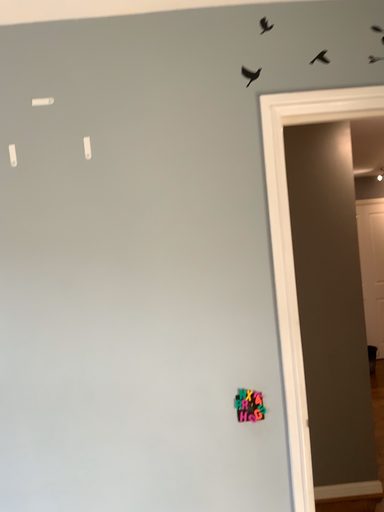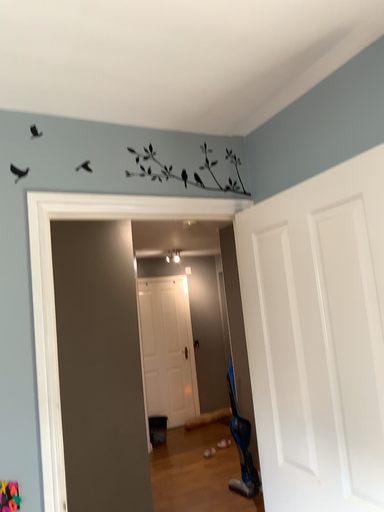
Question: How did the camera likely rotate when shooting the video?

Choices:
 (A) rotated right
 (B) rotated left

Answer: (A)